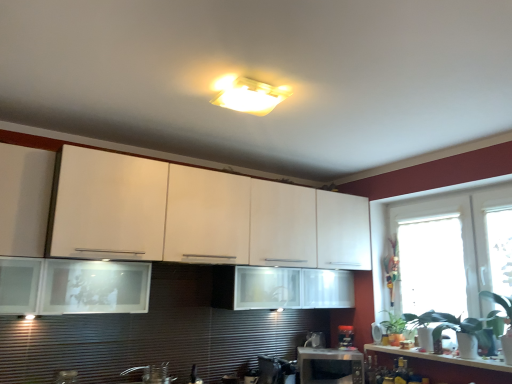
How much space does satin black coffee maker at lower center, arranged as the 1th appliance when viewed from the left, occupy horizontally?

satin black coffee maker at lower center, arranged as the 1th appliance when viewed from the left, is 13.98 inches wide.

This screenshot has height=384, width=512. Describe the element at coordinates (345, 336) in the screenshot. I see `black plastic toaster at lower center, which is counted as the third appliance, starting from the left` at that location.

You are a GUI agent. You are given a task and a screenshot of the screen. Output one action in this format:
    pyautogui.click(x=<x>, y=<y>)
    Task: Click on the metallic silver toaster at center, which is the 2th appliance in right-to-left order
    Image resolution: width=512 pixels, height=384 pixels.
    Given the screenshot: What is the action you would take?
    pyautogui.click(x=315, y=340)

What are the coordinates of `matte plastic light fixture at center` in the screenshot? It's located at (248, 95).

This screenshot has height=384, width=512. What do you see at coordinates (152, 373) in the screenshot? I see `brushed metal faucet at lower center` at bounding box center [152, 373].

Measure the distance between point (391,332) and camera.

Point (391,332) and camera are 3.19 meters apart from each other.

The height and width of the screenshot is (384, 512). Identify the location of transparent glass window at right, which ranks as the 2th window in left-to-right order. (440, 250).

Is satin black coffee maker at lower center, placed as the 3th appliance when sorted from right to left, facing away from metallic silver toaster at center, the 2th appliance when ordered from left to right?

That's not correct — satin black coffee maker at lower center, placed as the 3th appliance when sorted from right to left, is not looking away from metallic silver toaster at center, the 2th appliance when ordered from left to right.

I want to click on appliance that is the 1st object located above the satin black coffee maker at lower center, arranged as the 1th appliance when viewed from the left (from the image's perspective), so click(315, 340).

Which object is positioned more to the left, satin black coffee maker at lower center, arranged as the 1th appliance when viewed from the left, or metallic silver toaster at center, which is the 2th appliance in right-to-left order?

satin black coffee maker at lower center, arranged as the 1th appliance when viewed from the left, is more to the left.

Considering the positions of points (283, 378) and (320, 335), is point (283, 378) closer to camera compared to point (320, 335)?

Yes, it is in front of point (320, 335).

Relative to matte plastic light fixture at center, is white matte cabinet at center in front or behind?

In the image, white matte cabinet at center appears behind matte plastic light fixture at center.

Can you confirm if white matte cabinet at center is bigger than matte plastic light fixture at center?

Yes.

Image resolution: width=512 pixels, height=384 pixels. I want to click on lamp on the right of the white matte cabinet at center, so click(248, 95).

Does white matte cabinet at center appear on the right side of matte plastic light fixture at center?

No.

Is transparent glass window at right, which appears as the third window when viewed from the right, smaller than brushed metal faucet at lower center?

No, transparent glass window at right, which appears as the third window when viewed from the right, is not smaller than brushed metal faucet at lower center.

Consider the image. From a real-world perspective, relative to brushed metal faucet at lower center, is transparent glass window at right, the 1th window positioned from the left, vertically above or below?

Clearly, from a real-world perspective, transparent glass window at right, the 1th window positioned from the left, is above brushed metal faucet at lower center.

Between transparent glass window at right, which appears as the third window when viewed from the right, and brushed metal faucet at lower center, which one has more height?

transparent glass window at right, which appears as the third window when viewed from the right.

Does transparent glass window at right, which ranks as the 2th window in left-to-right order, lie in front of white glossy countertop at lower right?

That is False.

Is point (450, 239) closer or farther from the camera than point (465, 364)?

Point (450, 239).

Is transparent glass window at right, which ranks as the 2th window in left-to-right order, taller or shorter than white glossy countertop at lower right?

transparent glass window at right, which ranks as the 2th window in left-to-right order, is taller than white glossy countertop at lower right.

Does transparent glass window at right, which ranks as the 2th window in left-to-right order, have a larger size compared to white glossy countertop at lower right?

Yes, transparent glass window at right, which ranks as the 2th window in left-to-right order, is bigger than white glossy countertop at lower right.

Does metallic silver toaster at center, which is the 2th appliance in right-to-left order, turn towards black plastic toaster at lower center, positioned as the 1th appliance in right-to-left order?

No, metallic silver toaster at center, which is the 2th appliance in right-to-left order, is not turned towards black plastic toaster at lower center, positioned as the 1th appliance in right-to-left order.

Is metallic silver toaster at center, the 2th appliance when ordered from left to right, with black plastic toaster at lower center, positioned as the 1th appliance in right-to-left order?

No, metallic silver toaster at center, the 2th appliance when ordered from left to right, is not with black plastic toaster at lower center, positioned as the 1th appliance in right-to-left order.

Which object is thinner, metallic silver toaster at center, the 2th appliance when ordered from left to right, or black plastic toaster at lower center, which is counted as the third appliance, starting from the left?

Thinner between the two is metallic silver toaster at center, the 2th appliance when ordered from left to right.

Is metallic silver toaster at center, the 2th appliance when ordered from left to right, taller or shorter than black plastic toaster at lower center, which is counted as the third appliance, starting from the left?

metallic silver toaster at center, the 2th appliance when ordered from left to right, is shorter than black plastic toaster at lower center, which is counted as the third appliance, starting from the left.

What's the angular difference between black plastic microwave at lower center and metallic silver toaster at center, the 2th appliance when ordered from left to right,'s facing directions?

0.561 degrees.

Considering the points (297, 349) and (307, 334), which point is in front, point (297, 349) or point (307, 334)?

The point (297, 349) is closer.

Can we say black plastic microwave at lower center lies outside metallic silver toaster at center, the 2th appliance when ordered from left to right?

black plastic microwave at lower center lies outside metallic silver toaster at center, the 2th appliance when ordered from left to right,'s area.

Is black plastic microwave at lower center wider than metallic silver toaster at center, the 2th appliance when ordered from left to right?

Correct, the width of black plastic microwave at lower center exceeds that of metallic silver toaster at center, the 2th appliance when ordered from left to right.

Is transparent glass window at right, the third window from the left, facing towards black plastic toaster at lower center, which is counted as the third appliance, starting from the left?

No, transparent glass window at right, the third window from the left, is not facing towards black plastic toaster at lower center, which is counted as the third appliance, starting from the left.

Is there a large distance between transparent glass window at right, positioned as the 1th window in right-to-left order, and black plastic toaster at lower center, positioned as the 1th appliance in right-to-left order?

Yes, transparent glass window at right, positioned as the 1th window in right-to-left order, and black plastic toaster at lower center, positioned as the 1th appliance in right-to-left order, are located far from each other.

Considering the sizes of objects transparent glass window at right, positioned as the 1th window in right-to-left order, and black plastic toaster at lower center, positioned as the 1th appliance in right-to-left order, in the image provided, who is taller, transparent glass window at right, positioned as the 1th window in right-to-left order, or black plastic toaster at lower center, positioned as the 1th appliance in right-to-left order,?

transparent glass window at right, positioned as the 1th window in right-to-left order.

From a real-world perspective, between transparent glass window at right, the third window from the left, and black plastic toaster at lower center, positioned as the 1th appliance in right-to-left order, who is vertically lower?

black plastic toaster at lower center, positioned as the 1th appliance in right-to-left order.

This screenshot has height=384, width=512. I want to click on appliance below the metallic silver toaster at center, which is the 2th appliance in right-to-left order (from a real-world perspective), so click(x=276, y=370).

What are the coordinates of `cabinetry behind the matte plastic light fixture at center` in the screenshot? It's located at (199, 216).

When comparing their distances from green leafy plant at right, does satin black coffee maker at lower center, arranged as the 1th appliance when viewed from the left, or transparent glass window at right, which ranks as the 2th window in left-to-right order, seem closer?

transparent glass window at right, which ranks as the 2th window in left-to-right order.

When comparing their distances from black plastic microwave at lower center, does brushed metal faucet at lower center or matte plastic light fixture at center seem closer?

The object closer to black plastic microwave at lower center is brushed metal faucet at lower center.

Estimate the real-world distances between objects in this image. Which object is closer to white glossy countertop at lower right, black plastic microwave at lower center or transparent glass window at right, positioned as the 1th window in right-to-left order?

black plastic microwave at lower center lies closer to white glossy countertop at lower right than the other object.

Estimate the real-world distances between objects in this image. Which object is closer to brushed metal faucet at lower center, green leafy plant at right or transparent glass window at right, positioned as the 1th window in right-to-left order?

green leafy plant at right lies closer to brushed metal faucet at lower center than the other object.

When comparing their distances from white matte cabinet at center, does black plastic microwave at lower center or matte plastic light fixture at center seem further?

black plastic microwave at lower center.

When comparing their distances from transparent glass window at right, which ranks as the 2th window in left-to-right order, does matte plastic light fixture at center or satin black coffee maker at lower center, arranged as the 1th appliance when viewed from the left, seem closer?

satin black coffee maker at lower center, arranged as the 1th appliance when viewed from the left.

Based on their spatial positions, is transparent glass window at right, positioned as the 1th window in right-to-left order, or transparent glass window at right, the 1th window positioned from the left, further from green leafy plant at right?

The object further to green leafy plant at right is transparent glass window at right, positioned as the 1th window in right-to-left order.

From the image, which object appears to be nearer to black plastic microwave at lower center, transparent glass window at right, which appears as the third window when viewed from the right, or metallic silver toaster at center, the 2th appliance when ordered from left to right?

metallic silver toaster at center, the 2th appliance when ordered from left to right, is closer to black plastic microwave at lower center.

Identify the location of lamp between brushed metal faucet at lower center and transparent glass window at right, the 1th window positioned from the left, in the horizontal direction. This screenshot has width=512, height=384. (248, 95).

You are a GUI agent. You are given a task and a screenshot of the screen. Output one action in this format:
    pyautogui.click(x=<x>, y=<y>)
    Task: Click on the countertop between black plastic microwave at lower center and transparent glass window at right, positioned as the 1th window in right-to-left order, from left to right
    
    Given the screenshot: What is the action you would take?
    pyautogui.click(x=441, y=358)

The image size is (512, 384). In order to click on table between satin black coffee maker at lower center, arranged as the 1th appliance when viewed from the left, and transparent glass window at right, the third window from the left in this screenshot , I will do `click(330, 366)`.

Image resolution: width=512 pixels, height=384 pixels. Identify the location of table between satin black coffee maker at lower center, placed as the 3th appliance when sorted from right to left, and green leafy plant at right, in the horizontal direction. (330, 366).